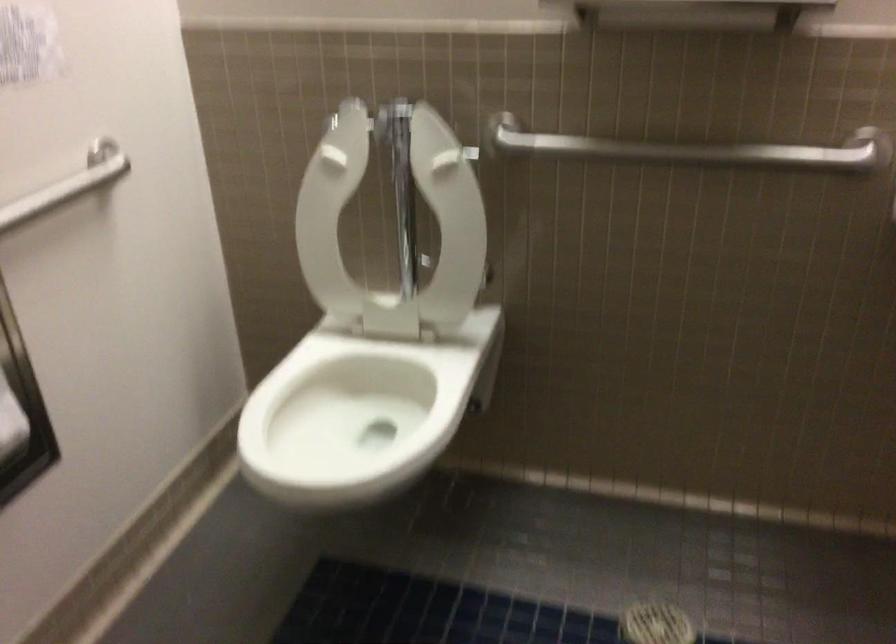
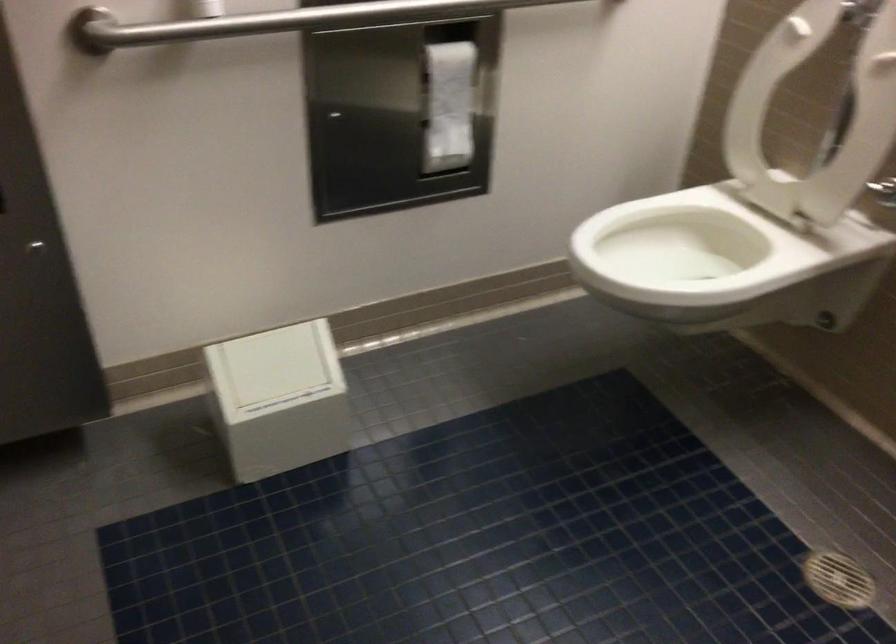
Find the pixel in the second image that matches (329,404) in the first image.

(684, 245)